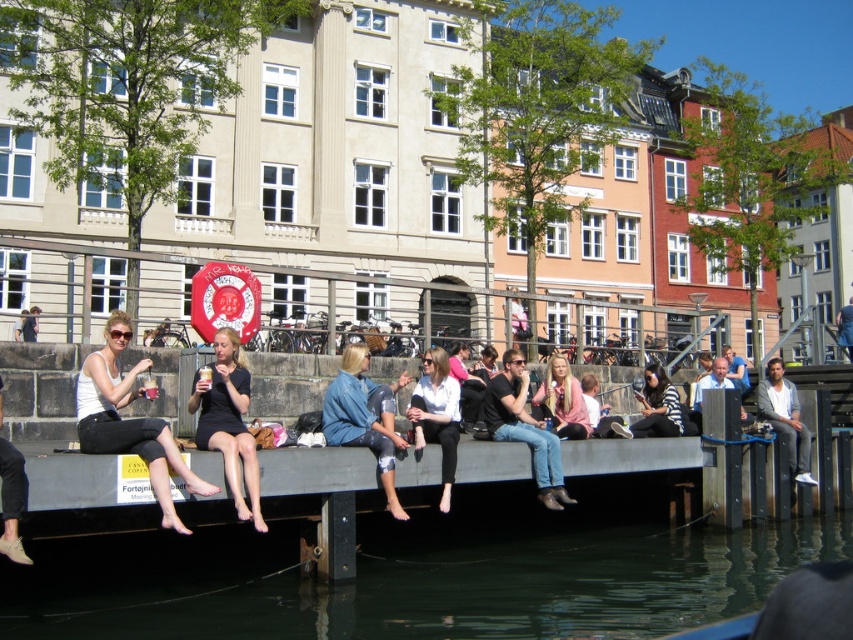
Question: Can you confirm if black matte dress at center is thinner than white matte shirt at center?

Choices:
 (A) yes
 (B) no

Answer: (B)

Question: In this image, where is pink fabric jacket at center located relative to dark blue jeans at center?

Choices:
 (A) left
 (B) right

Answer: (A)

Question: Which of these objects is positioned closest to the light gray jeans at right?

Choices:
 (A) white matte shirt at center
 (B) striped cotton shirt at center
 (C) black leather jacket at center

Answer: (B)

Question: Is matte white tank top at left further to the viewer compared to white matte shirt at center?

Choices:
 (A) no
 (B) yes

Answer: (A)

Question: Among these objects, which one is nearest to the camera?

Choices:
 (A) black matte dress at center
 (B) matte white tank top at left
 (C) dark blue jeans at center

Answer: (B)

Question: Estimate the real-world distances between objects in this image. Which object is closer to the white matte shirt at center?

Choices:
 (A) light blue shirt at center
 (B) striped cotton shirt at center
 (C) black leather jacket at center
 (D) denim jacket at center

Answer: (D)